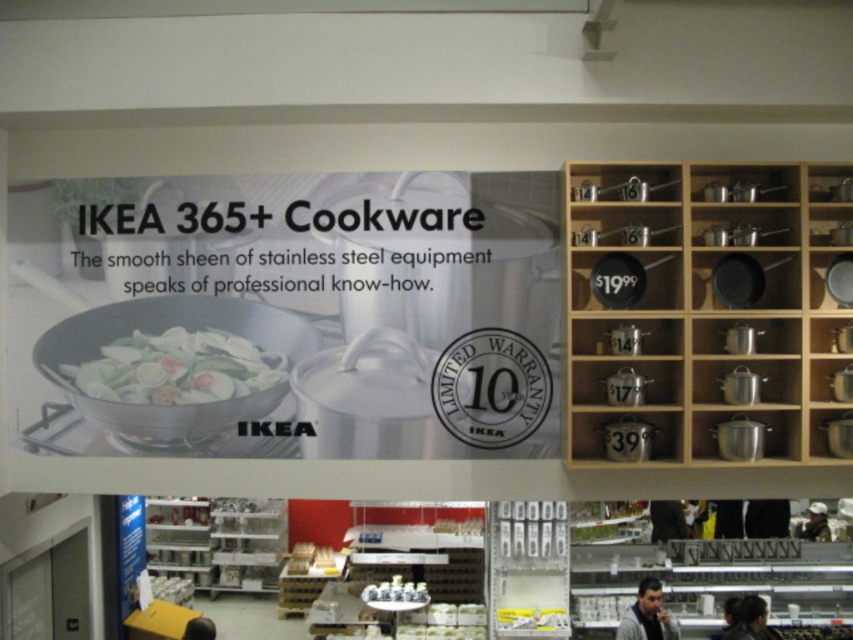
Question: Is green matte vegetables at center bigger than white glossy salt shaker at center?

Choices:
 (A) yes
 (B) no

Answer: (B)

Question: Which point is farther to the camera?

Choices:
 (A) white glossy salt shaker at center
 (B) green matte vegetables at center

Answer: (A)

Question: Can you confirm if green matte vegetables at center is positioned below white glossy salt shaker at center?

Choices:
 (A) yes
 (B) no

Answer: (B)

Question: In this image, where is green matte vegetables at center located relative to white glossy salt shaker at center?

Choices:
 (A) above
 (B) below

Answer: (A)